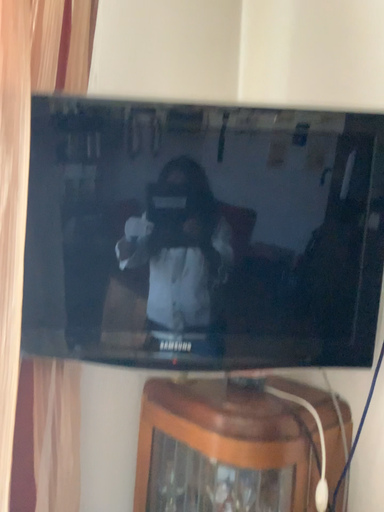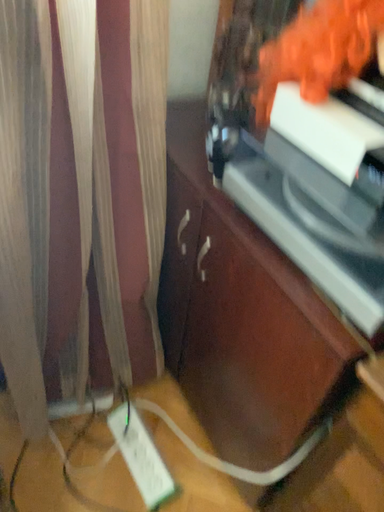
Question: How did the camera likely rotate when shooting the video?

Choices:
 (A) rotated downward
 (B) rotated upward

Answer: (A)